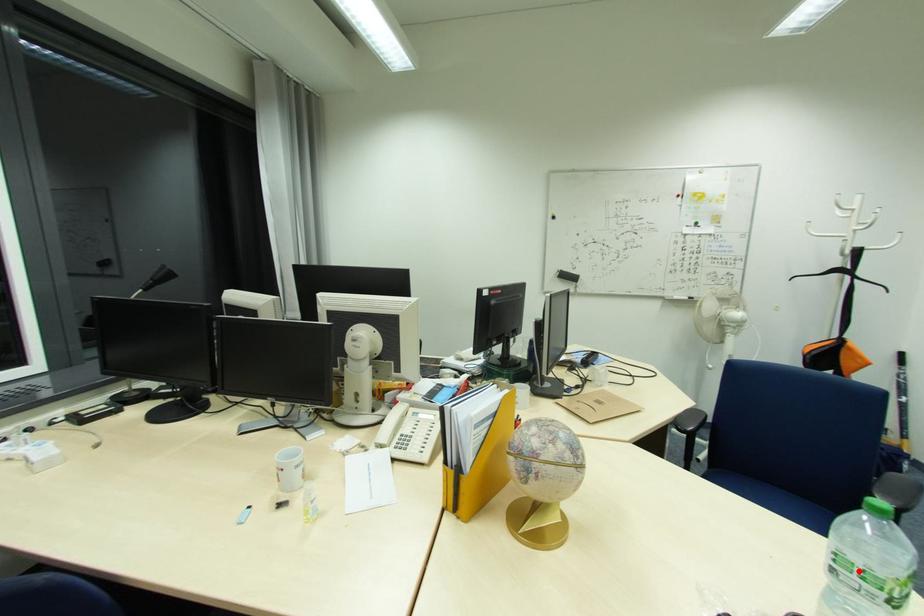
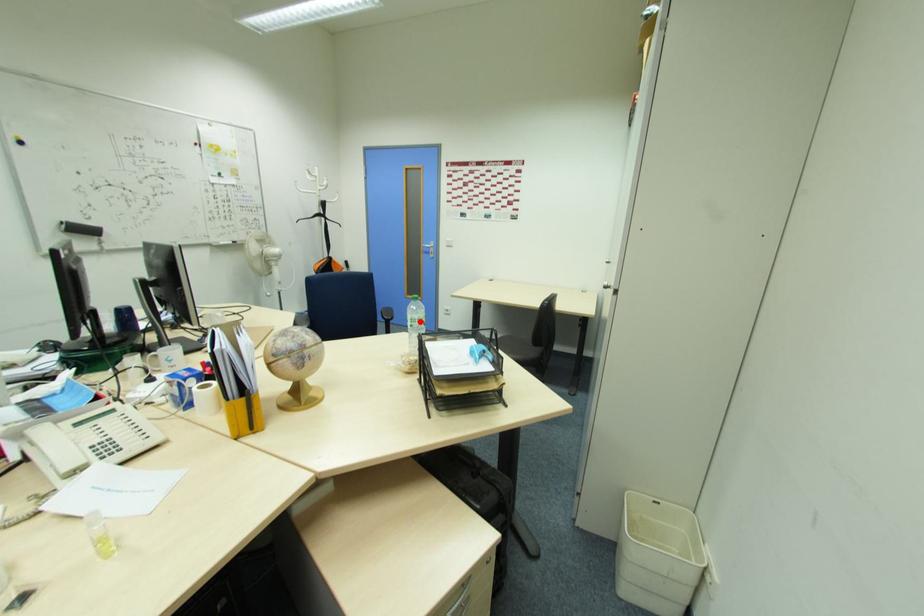
I am providing you with two images of the same scene from different viewpoints. A red point is marked on the first image and another point is marked on the second image. Is the marked point in image1 the same physical position as the marked point in image2?

Yes